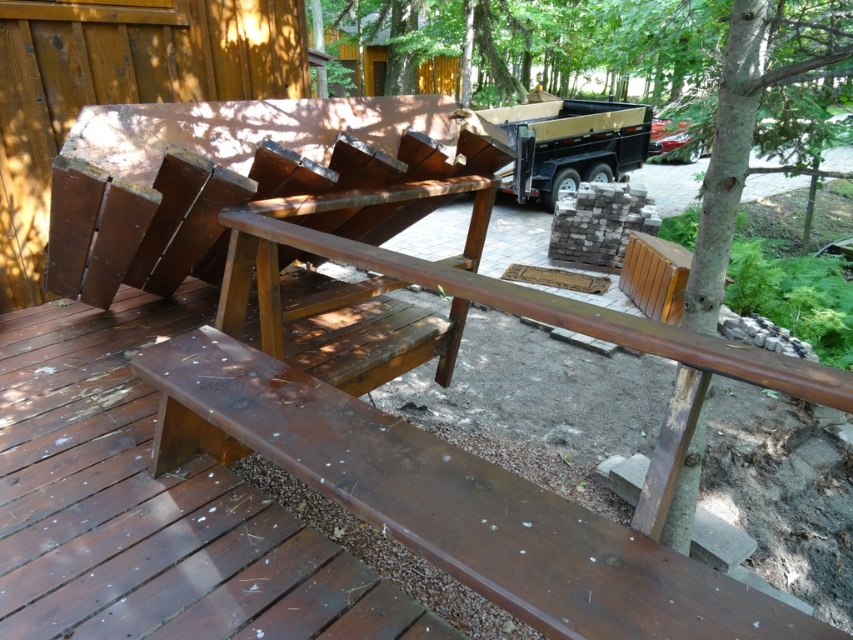
Question: Where is matte brown bench at lower center located in relation to brown wood tree at upper center in the image?

Choices:
 (A) right
 (B) left

Answer: (B)

Question: Among these objects, which one is nearest to the camera?

Choices:
 (A) brown wood tree at upper center
 (B) matte brown bench at lower center

Answer: (B)

Question: Is matte brown bench at lower center above brown wood tree at upper center?

Choices:
 (A) yes
 (B) no

Answer: (B)

Question: Among these points, which one is nearest to the camera?

Choices:
 (A) (671, 627)
 (B) (746, 172)

Answer: (A)

Question: Observing the image, what is the correct spatial positioning of matte brown bench at lower center in reference to brown wood tree at upper center?

Choices:
 (A) right
 (B) left

Answer: (B)

Question: Which of the following is the farthest from the observer?

Choices:
 (A) brown wood tree at upper center
 (B) matte brown bench at lower center

Answer: (A)